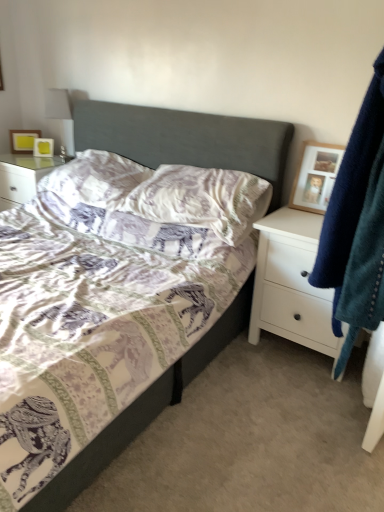
Find the location of a particular element. white matte chest of drawers at right is located at coordinates (292, 283).

In order to face velvety blue robe at right, should I rotate leftwards or rightwards?

You should rotate right by 24.980 degrees.

Describe the element at coordinates (202, 199) in the screenshot. This screenshot has height=512, width=384. I see `purple elephant-patterned pillow at center, the first pillow positioned from the right` at that location.

Measure the distance between matte yellow picture frame at upper left, marked as the 2th picture frame in a bottom-to-top arrangement, and camera.

matte yellow picture frame at upper left, marked as the 2th picture frame in a bottom-to-top arrangement, and camera are 2.99 meters apart from each other.

The width and height of the screenshot is (384, 512). In order to click on matte yellow picture frame at upper left, arranged as the 1th picture frame when viewed from the left in this screenshot , I will do `click(23, 140)`.

What is the approximate height of wooden picture frame at upper right, which is the third picture frame from left to right?

wooden picture frame at upper right, which is the third picture frame from left to right, is 15.54 inches tall.

This screenshot has height=512, width=384. Find the location of `printed fabric pillow at center, positioned as the 1th pillow in left-to-right order`. printed fabric pillow at center, positioned as the 1th pillow in left-to-right order is located at coordinates (95, 179).

Which object is thinner, printed fabric pillow at center, acting as the 2th pillow starting from the right, or white matte chest of drawers at right?

printed fabric pillow at center, acting as the 2th pillow starting from the right, is thinner.

Can you confirm if printed fabric pillow at center, positioned as the 1th pillow in left-to-right order, is positioned to the left of white matte chest of drawers at right?

Yes.

Considering the relative sizes of printed fabric pillow at center, positioned as the 1th pillow in left-to-right order, and white matte chest of drawers at right in the image provided, is printed fabric pillow at center, positioned as the 1th pillow in left-to-right order, bigger than white matte chest of drawers at right?

Actually, printed fabric pillow at center, positioned as the 1th pillow in left-to-right order, might be smaller than white matte chest of drawers at right.

From their relative heights in the image, would you say printed fabric pillow at center, acting as the 2th pillow starting from the right, is taller or shorter than white matte chest of drawers at right?

In the image, printed fabric pillow at center, acting as the 2th pillow starting from the right, appears to be shorter than white matte chest of drawers at right.

Which is in front, point (45, 142) or point (99, 193)?

The point (99, 193) is more forward.

From a real-world perspective, between matte yellow picture frame at upper left, which is the second picture frame in right-to-left order, and printed fabric pillow at center, acting as the 2th pillow starting from the right, who is vertically lower?

From a 3D spatial view, printed fabric pillow at center, acting as the 2th pillow starting from the right, is below.

From the image's perspective, is matte yellow picture frame at upper left, positioned as the second picture frame in left-to-right order, below printed fabric pillow at center, positioned as the 1th pillow in left-to-right order?

No.

Looking at this image, is purple elephant-patterned pillow at center, arranged as the second pillow when viewed from the left, facing away from white matte chest of drawers at right?

No, white matte chest of drawers at right is not at the back of purple elephant-patterned pillow at center, arranged as the second pillow when viewed from the left.

Measure the distance between purple elephant-patterned pillow at center, the first pillow positioned from the right, and white matte chest of drawers at right.

purple elephant-patterned pillow at center, the first pillow positioned from the right, is 12.76 inches away from white matte chest of drawers at right.

Where is `the chest of drawers that is under the purple elephant-patterned pillow at center, the first pillow positioned from the right (from a real-world perspective)`? the chest of drawers that is under the purple elephant-patterned pillow at center, the first pillow positioned from the right (from a real-world perspective) is located at coordinates (292, 283).

From the image's perspective, between purple elephant-patterned pillow at center, the first pillow positioned from the right, and white matte chest of drawers at right, which one is located above?

From the image's view, purple elephant-patterned pillow at center, the first pillow positioned from the right, is above.

Does matte yellow picture frame at upper left, which ranks as the third picture frame in front-to-back order, have a greater height compared to matte yellow picture frame at upper left, positioned as the second picture frame in left-to-right order?

Indeed, matte yellow picture frame at upper left, which ranks as the third picture frame in front-to-back order, has a greater height compared to matte yellow picture frame at upper left, positioned as the second picture frame in left-to-right order.

Is matte yellow picture frame at upper left, the 3th picture frame viewed from the right, located outside matte yellow picture frame at upper left, which is the second picture frame in right-to-left order?

matte yellow picture frame at upper left, the 3th picture frame viewed from the right, is positioned outside matte yellow picture frame at upper left, which is the second picture frame in right-to-left order.

Measure the distance between matte yellow picture frame at upper left, the first picture frame positioned from the back, and matte yellow picture frame at upper left, marked as the 2th picture frame in a top-to-bottom arrangement.

matte yellow picture frame at upper left, the first picture frame positioned from the back, and matte yellow picture frame at upper left, marked as the 2th picture frame in a top-to-bottom arrangement, are 4.06 inches apart.

Can you tell me how much matte yellow picture frame at upper left, arranged as the 1th picture frame when viewed from the left, and matte yellow picture frame at upper left, marked as the 2th picture frame in a bottom-to-top arrangement, differ in facing direction?

They differ by 4.59 degrees in their facing directions.

Is printed fabric pillow at center, acting as the 2th pillow starting from the right, positioned with its back to purple elephant-patterned pillow at center, arranged as the second pillow when viewed from the left?

No.

Find the location of `pillow in front of the printed fabric pillow at center, positioned as the 1th pillow in left-to-right order`. pillow in front of the printed fabric pillow at center, positioned as the 1th pillow in left-to-right order is located at coordinates (202, 199).

Is point (77, 199) positioned after point (267, 192)?

Yes.

Are matte yellow picture frame at upper left, the 1th picture frame in the top-to-bottom sequence, and printed fabric pillow at center, acting as the 2th pillow starting from the right, far apart?

matte yellow picture frame at upper left, the 1th picture frame in the top-to-bottom sequence, is actually quite close to printed fabric pillow at center, acting as the 2th pillow starting from the right.

Looking at the image, does matte yellow picture frame at upper left, arranged as the 1th picture frame when viewed from the left, seem bigger or smaller compared to printed fabric pillow at center, positioned as the 1th pillow in left-to-right order?

In the image, matte yellow picture frame at upper left, arranged as the 1th picture frame when viewed from the left, appears to be smaller than printed fabric pillow at center, positioned as the 1th pillow in left-to-right order.

The image size is (384, 512). I want to click on the 1st pillow counting from the right of the matte yellow picture frame at upper left, the 1th picture frame in the top-to-bottom sequence, so click(95, 179).

Between velvety blue robe at right and white matte chest of drawers at right, which one has less height?

white matte chest of drawers at right is shorter.

Is velvety blue robe at right spatially inside white matte chest of drawers at right, or outside of it?

velvety blue robe at right is not enclosed by white matte chest of drawers at right.

Are velvety blue robe at right and white matte chest of drawers at right located far from each other?

That's not correct — velvety blue robe at right is a little close to white matte chest of drawers at right.

In terms of width, does velvety blue robe at right look wider or thinner when compared to white matte chest of drawers at right?

Clearly, velvety blue robe at right has less width compared to white matte chest of drawers at right.

From the white matte chest of drawers at right, count 2nd pillows backward and point to it. Please provide its 2D coordinates.

[(95, 179)]

From the matte yellow picture frame at upper left, marked as the 2th picture frame in a bottom-to-top arrangement, count 1st pillow to the right and point to it. Please provide its 2D coordinates.

[(95, 179)]

From the image, which object appears to be nearer to printed fabric pillow at center, acting as the 2th pillow starting from the right, wooden picture frame at upper right, which is the 1th picture frame in front-to-back order, or purple elephant-patterned pillow at center, arranged as the second pillow when viewed from the left?

The object closer to printed fabric pillow at center, acting as the 2th pillow starting from the right, is purple elephant-patterned pillow at center, arranged as the second pillow when viewed from the left.

Estimate the real-world distances between objects in this image. Which object is further from white matte chest of drawers at right, matte yellow picture frame at upper left, the 3th picture frame in the bottom-to-top sequence, or velvety blue robe at right?

matte yellow picture frame at upper left, the 3th picture frame in the bottom-to-top sequence.

Consider the image. Considering their positions, is matte yellow picture frame at upper left, arranged as the 1th picture frame when viewed from the left, positioned closer to printed fabric pillow at center, positioned as the 1th pillow in left-to-right order, than matte yellow picture frame at upper left, marked as the 2th picture frame in a bottom-to-top arrangement?

Based on the image, matte yellow picture frame at upper left, marked as the 2th picture frame in a bottom-to-top arrangement, appears to be nearer to printed fabric pillow at center, positioned as the 1th pillow in left-to-right order.

Consider the image. Considering their positions, is wooden picture frame at upper right, marked as the first picture frame in a bottom-to-top arrangement, positioned closer to matte yellow picture frame at upper left, the 1th picture frame in the top-to-bottom sequence, than textured gray bed at center?

textured gray bed at center is positioned closer to the anchor matte yellow picture frame at upper left, the 1th picture frame in the top-to-bottom sequence.

Estimate the real-world distances between objects in this image. Which object is closer to matte yellow picture frame at upper left, which is the second picture frame in right-to-left order, textured gray bed at center or white matte chest of drawers at right?

Among the two, textured gray bed at center is located nearer to matte yellow picture frame at upper left, which is the second picture frame in right-to-left order.

From the picture: Estimate the real-world distances between objects in this image. Which object is further from wooden picture frame at upper right, which is the 1th picture frame in front-to-back order, purple elephant-patterned pillow at center, the first pillow positioned from the right, or white matte chest of drawers at right?

purple elephant-patterned pillow at center, the first pillow positioned from the right, lies further to wooden picture frame at upper right, which is the 1th picture frame in front-to-back order, than the other object.

Considering their positions, is textured gray bed at center positioned further to matte yellow picture frame at upper left, which ranks as the third picture frame in front-to-back order, than matte yellow picture frame at upper left, marked as the 2th picture frame in a top-to-bottom arrangement?

textured gray bed at center is further to matte yellow picture frame at upper left, which ranks as the third picture frame in front-to-back order.

Estimate the real-world distances between objects in this image. Which object is closer to purple elephant-patterned pillow at center, arranged as the second pillow when viewed from the left, velvety blue robe at right or matte yellow picture frame at upper left, which is the second picture frame in right-to-left order?

Among the two, velvety blue robe at right is located nearer to purple elephant-patterned pillow at center, arranged as the second pillow when viewed from the left.

The width and height of the screenshot is (384, 512). In order to click on chest of drawers between matte yellow picture frame at upper left, positioned as the second picture frame in left-to-right order, and wooden picture frame at upper right, which is the third picture frame from left to right, from left to right in this screenshot , I will do `click(292, 283)`.

This screenshot has height=512, width=384. Identify the location of pillow positioned between textured gray bed at center and printed fabric pillow at center, acting as the 2th pillow starting from the right, from near to far. (202, 199).

This screenshot has width=384, height=512. Find the location of `the chest of drawers located between textured gray bed at center and matte yellow picture frame at upper left, the 1th picture frame in the top-to-bottom sequence, in the depth direction`. the chest of drawers located between textured gray bed at center and matte yellow picture frame at upper left, the 1th picture frame in the top-to-bottom sequence, in the depth direction is located at coordinates (292, 283).

What are the coordinates of `chest of drawers between purple elephant-patterned pillow at center, arranged as the second pillow when viewed from the left, and wooden picture frame at upper right, which is the 1th picture frame in right-to-left order` in the screenshot? It's located at (292, 283).